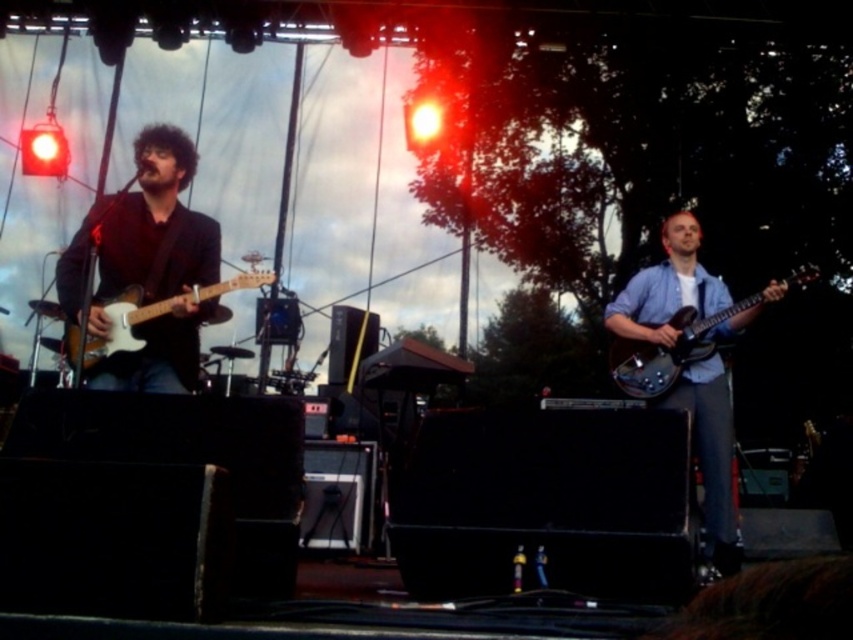
You are standing at the camera position and want to reach the point marked at coordinates point (126, 253). The venue has a safety rule that you must stay at least 10 feet away from the stage area. Can you safely walk to that point?

The point marked at coordinates point (126, 253) is 11.42 feet away from the camera, which exceeds the required 10 feet safety distance. Therefore, you can safely walk to that point while adhering to the safety rule.

Looking at this image, you are a photographer at the concert venue. You want to take a photo of the blue denim shirt at right and the glossy black guitar at right. Which object should you focus on first if you want to capture both in the same frame without moving the camera?

The blue denim shirt at right is bigger than the glossy black guitar at right, so you should focus on the blue denim shirt at right first to ensure it is in clear view before adjusting for the smaller glossy black guitar at right.